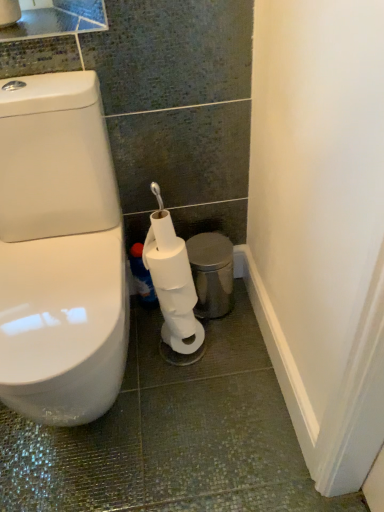
Question: Is metallic silver trash can at lower right turned away from blue glossy bottle at lower center?

Choices:
 (A) no
 (B) yes

Answer: (A)

Question: Considering the relative sizes of metallic silver trash can at lower right and blue glossy bottle at lower center in the image provided, is metallic silver trash can at lower right bigger than blue glossy bottle at lower center?

Choices:
 (A) no
 (B) yes

Answer: (B)

Question: Is metallic silver trash can at lower right at the left side of blue glossy bottle at lower center?

Choices:
 (A) yes
 (B) no

Answer: (B)

Question: Is metallic silver trash can at lower right next to blue glossy bottle at lower center?

Choices:
 (A) yes
 (B) no

Answer: (B)

Question: Does metallic silver trash can at lower right have a lesser width compared to blue glossy bottle at lower center?

Choices:
 (A) no
 (B) yes

Answer: (A)

Question: Does metallic silver trash can at lower right come in front of blue glossy bottle at lower center?

Choices:
 (A) no
 (B) yes

Answer: (B)

Question: Does white matte toilet paper at lower center appear on the left side of blue glossy bottle at lower center?

Choices:
 (A) no
 (B) yes

Answer: (A)

Question: Is white matte toilet paper at lower center positioned in front of blue glossy bottle at lower center?

Choices:
 (A) no
 (B) yes

Answer: (B)

Question: From a real-world perspective, is white matte toilet paper at lower center positioned under blue glossy bottle at lower center based on gravity?

Choices:
 (A) yes
 (B) no

Answer: (B)

Question: Does white matte toilet paper at lower center have a greater height compared to blue glossy bottle at lower center?

Choices:
 (A) yes
 (B) no

Answer: (A)

Question: Is white matte toilet paper at lower center behind blue glossy bottle at lower center?

Choices:
 (A) yes
 (B) no

Answer: (B)

Question: Can you confirm if white matte toilet paper at lower center is shorter than blue glossy bottle at lower center?

Choices:
 (A) yes
 (B) no

Answer: (B)

Question: Does blue glossy bottle at lower center have a greater height compared to metallic silver trash can at lower right?

Choices:
 (A) yes
 (B) no

Answer: (B)